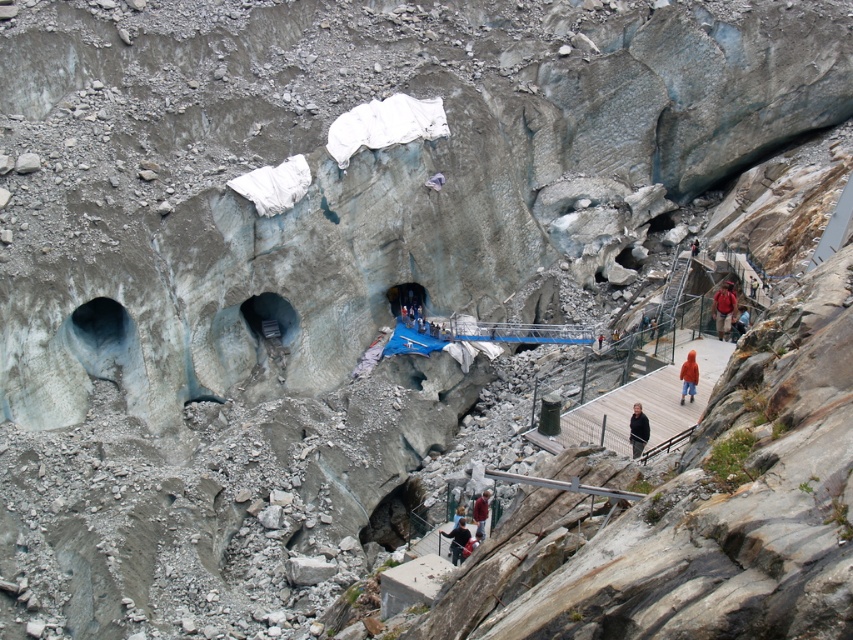
You are a tour guide leading a group on the wooden walkway. You notice two visitors wearing the orange fuzzy jacket at lower right and the dark blue jacket at lower center. Which jacket is more likely to belong to a child?

The orange fuzzy jacket at lower right has a smaller size compared to the dark blue jacket at lower center, so it is more likely to belong to a child.

You are a tour guide leading a group on the wooden walkway. You notice two visitors wearing a dark blue jacket at lower center and a red woolen sweater at lower center. Which visitor is standing closer to the left side of the walkway?

The dark blue jacket at lower center is positioned on the left side of red woolen sweater at lower center, so the visitor wearing the dark blue jacket at lower center is standing closer to the left side of the walkway.

You are a tour guide leading a group on the wooden walkway. You notice two visitors wearing the orange fuzzy jacket at lower right and the dark blue jacket at lower center. Which jacket is closer to the walkway?

The orange fuzzy jacket at lower right is closer to the walkway because it is positioned at the lower right, which is near the starting point of the walkway, whereas the dark blue jacket at lower center is further along the path.